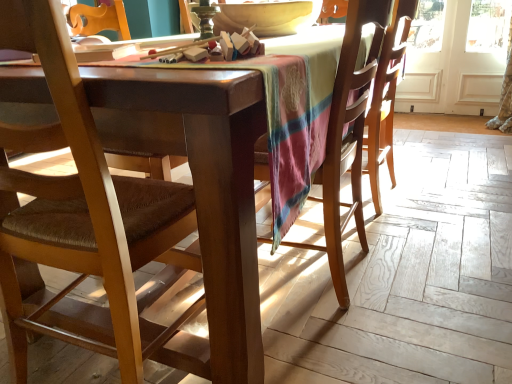
The height and width of the screenshot is (384, 512). What do you see at coordinates (472, 59) in the screenshot?
I see `white wood screen door at upper right` at bounding box center [472, 59].

Find the location of a particular element. This screenshot has height=384, width=512. brown fabric chair at left, which ranks as the second chair in right-to-left order is located at coordinates (133, 194).

Is matte yellow bowl at upper center wider or thinner than white wood screen door at upper right?

matte yellow bowl at upper center is wider than white wood screen door at upper right.

Is matte yellow bowl at upper center far from white wood screen door at upper right?

That's right, there is a large distance between matte yellow bowl at upper center and white wood screen door at upper right.

Is matte yellow bowl at upper center smaller than white wood screen door at upper right?

Incorrect, matte yellow bowl at upper center is not smaller in size than white wood screen door at upper right.

Is point (313, 16) in front of point (465, 96)?

Yes, point (313, 16) is closer to viewer.

Locate an element on the screen. bowl above the wooden chair at center, marked as the 1th chair in a right-to-left arrangement (from a real-world perspective) is located at coordinates (267, 17).

Consider the image. Is matte yellow bowl at upper center facing away from wooden chair at center, which ranks as the 2th chair in left-to-right order?

No.

Is matte yellow bowl at upper center positioned beyond the bounds of wooden chair at center, marked as the 1th chair in a right-to-left arrangement?

matte yellow bowl at upper center is positioned outside wooden chair at center, marked as the 1th chair in a right-to-left arrangement.

From the image's perspective, which one is positioned higher, brown fabric chair at left, which ranks as the second chair in right-to-left order, or white wood screen door at upper right?

white wood screen door at upper right appears higher in the image.

Is brown fabric chair at left, which ranks as the second chair in right-to-left order, facing towards white wood screen door at upper right?

Yes, brown fabric chair at left, which ranks as the second chair in right-to-left order, is oriented towards white wood screen door at upper right.

Between brown fabric chair at left, the first chair in the left-to-right sequence, and white wood screen door at upper right, which one has less height?

Standing shorter between the two is brown fabric chair at left, the first chair in the left-to-right sequence.

From a real-world perspective, is brown fabric chair at left, the first chair in the left-to-right sequence, above or below white wood screen door at upper right?

In terms of real-world spatial position, brown fabric chair at left, the first chair in the left-to-right sequence, is above white wood screen door at upper right.

Considering the relative positions of white wood screen door at upper right and wooden chair at center, marked as the 1th chair in a right-to-left arrangement, in the image provided, is white wood screen door at upper right behind wooden chair at center, marked as the 1th chair in a right-to-left arrangement,?

Yes, it is behind wooden chair at center, marked as the 1th chair in a right-to-left arrangement.

Who is shorter, white wood screen door at upper right or wooden chair at center, marked as the 1th chair in a right-to-left arrangement?

wooden chair at center, marked as the 1th chair in a right-to-left arrangement, is shorter.

What's the angular difference between white wood screen door at upper right and wooden chair at center, which ranks as the 2th chair in left-to-right order,'s facing directions?

The angular difference between white wood screen door at upper right and wooden chair at center, which ranks as the 2th chair in left-to-right order, is 88.3 degrees.

In the scene shown: From a real-world perspective, which is physically above, brown fabric chair at left, which ranks as the second chair in right-to-left order, or wooden chair at center, which ranks as the 2th chair in left-to-right order?

brown fabric chair at left, which ranks as the second chair in right-to-left order, is physically above.

Based on their sizes in the image, would you say brown fabric chair at left, which ranks as the second chair in right-to-left order, is bigger or smaller than wooden chair at center, which ranks as the 2th chair in left-to-right order?

Considering their sizes, brown fabric chair at left, which ranks as the second chair in right-to-left order, takes up more space than wooden chair at center, which ranks as the 2th chair in left-to-right order.

Is brown fabric chair at left, the first chair in the left-to-right sequence, oriented towards wooden chair at center, which ranks as the 2th chair in left-to-right order?

Yes, brown fabric chair at left, the first chair in the left-to-right sequence, faces towards wooden chair at center, which ranks as the 2th chair in left-to-right order.

Is brown fabric chair at left, the first chair in the left-to-right sequence, positioned far away from wooden chair at center, which ranks as the 2th chair in left-to-right order?

brown fabric chair at left, the first chair in the left-to-right sequence, is near wooden chair at center, which ranks as the 2th chair in left-to-right order, not far away.

Consider the image. Considering the relative sizes of brown fabric chair at left, the first chair in the left-to-right sequence, and matte yellow bowl at upper center in the image provided, is brown fabric chair at left, the first chair in the left-to-right sequence, wider than matte yellow bowl at upper center?

Result: No.

From a real-world perspective, which is physically below, brown fabric chair at left, the first chair in the left-to-right sequence, or matte yellow bowl at upper center?

From a 3D spatial view, brown fabric chair at left, the first chair in the left-to-right sequence, is below.

Is point (113, 226) closer to camera compared to point (247, 21)?

Yes.

From the image's perspective, is brown fabric chair at left, the first chair in the left-to-right sequence, on top of matte yellow bowl at upper center?

No, from the image's perspective, brown fabric chair at left, the first chair in the left-to-right sequence, is not on top of matte yellow bowl at upper center.

Is white wood screen door at upper right positioned with its back to matte yellow bowl at upper center?

No, matte yellow bowl at upper center is not at the back of white wood screen door at upper right.

From a real-world perspective, is white wood screen door at upper right on top of matte yellow bowl at upper center?

Actually, white wood screen door at upper right is physically below matte yellow bowl at upper center in the real world.

From the image's perspective, who appears lower, white wood screen door at upper right or matte yellow bowl at upper center?

matte yellow bowl at upper center.

Does white wood screen door at upper right lie in front of matte yellow bowl at upper center?

That is False.

Where is `bowl lying in front of the white wood screen door at upper right`? The height and width of the screenshot is (384, 512). bowl lying in front of the white wood screen door at upper right is located at coordinates (267, 17).

You are a GUI agent. You are given a task and a screenshot of the screen. Output one action in this format:
    pyautogui.click(x=<x>, y=<y>)
    Task: Click on the bowl located above the wooden chair at center, marked as the 1th chair in a right-to-left arrangement (from the image's perspective)
    The image size is (512, 384).
    Given the screenshot: What is the action you would take?
    pyautogui.click(x=267, y=17)

From the image, which object appears to be farther from wooden chair at center, marked as the 1th chair in a right-to-left arrangement, white wood screen door at upper right or brown fabric chair at left, the first chair in the left-to-right sequence?

white wood screen door at upper right is positioned further to the anchor wooden chair at center, marked as the 1th chair in a right-to-left arrangement.

Which object lies nearer to the anchor point brown fabric chair at left, the first chair in the left-to-right sequence, matte yellow bowl at upper center or white wood screen door at upper right?

matte yellow bowl at upper center.

Consider the image. Looking at the image, which one is located closer to wooden chair at center, which ranks as the 2th chair in left-to-right order, matte yellow bowl at upper center or brown fabric chair at left, the first chair in the left-to-right sequence?

matte yellow bowl at upper center is closer to wooden chair at center, which ranks as the 2th chair in left-to-right order.

When comparing their distances from brown fabric chair at left, the first chair in the left-to-right sequence, does white wood screen door at upper right or wooden chair at center, marked as the 1th chair in a right-to-left arrangement, seem further?

Among the two, white wood screen door at upper right is located further to brown fabric chair at left, the first chair in the left-to-right sequence.

Estimate the real-world distances between objects in this image. Which object is further from matte yellow bowl at upper center, brown fabric chair at left, the first chair in the left-to-right sequence, or wooden chair at center, which ranks as the 2th chair in left-to-right order?

brown fabric chair at left, the first chair in the left-to-right sequence, is positioned further to the anchor matte yellow bowl at upper center.

Looking at the image, which one is located further to wooden chair at center, which ranks as the 2th chair in left-to-right order, brown fabric chair at left, which ranks as the second chair in right-to-left order, or white wood screen door at upper right?

white wood screen door at upper right lies further to wooden chair at center, which ranks as the 2th chair in left-to-right order, than the other object.

When comparing their distances from wooden chair at center, which ranks as the 2th chair in left-to-right order, does matte yellow bowl at upper center or white wood screen door at upper right seem further?

white wood screen door at upper right is positioned further to the anchor wooden chair at center, which ranks as the 2th chair in left-to-right order.

Looking at the image, which one is located further to wooden chair at center, marked as the 1th chair in a right-to-left arrangement, brown fabric chair at left, the first chair in the left-to-right sequence, or matte yellow bowl at upper center?

brown fabric chair at left, the first chair in the left-to-right sequence, lies further to wooden chair at center, marked as the 1th chair in a right-to-left arrangement, than the other object.

Find the location of a particular element. The width and height of the screenshot is (512, 384). chair between brown fabric chair at left, which ranks as the second chair in right-to-left order, and white wood screen door at upper right from front to back is located at coordinates (347, 137).

Locate an element on the screen. bowl located between brown fabric chair at left, the first chair in the left-to-right sequence, and white wood screen door at upper right in the depth direction is located at coordinates (x=267, y=17).

In order to click on bowl between wooden chair at center, marked as the 1th chair in a right-to-left arrangement, and white wood screen door at upper right, along the z-axis in this screenshot , I will do `click(267, 17)`.

Identify the location of chair located between brown fabric chair at left, the first chair in the left-to-right sequence, and matte yellow bowl at upper center in the depth direction. This screenshot has width=512, height=384. (347, 137).